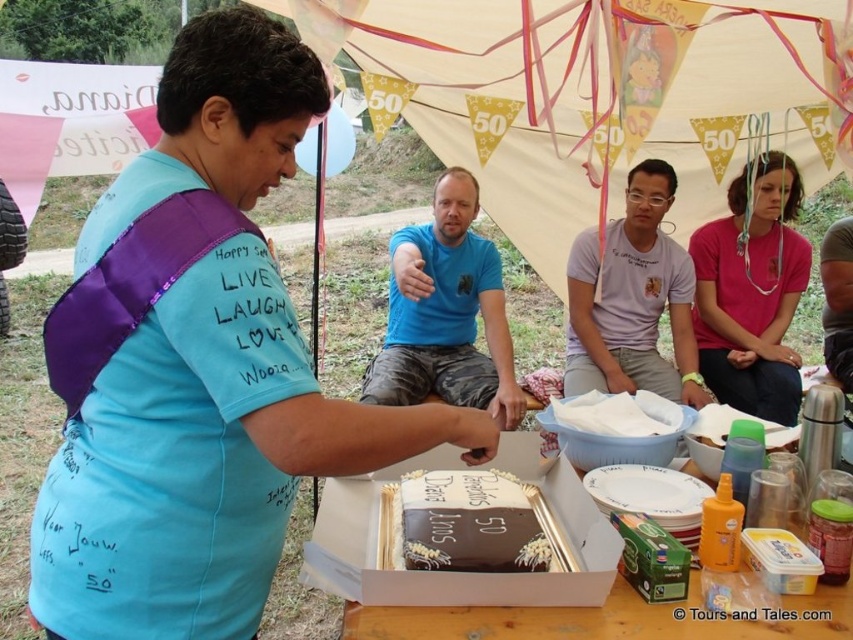
Looking at this image, what are the coordinates of the chocolate cake at center?

The chocolate cake at center is located at point (508, 602).